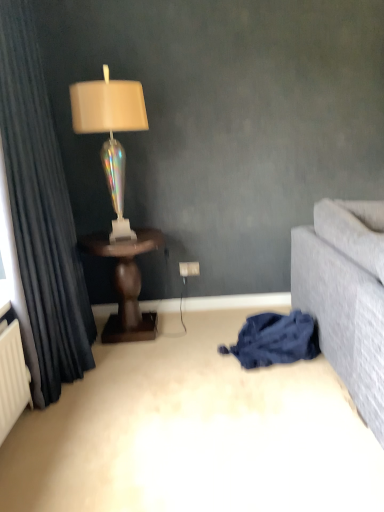
Question: Is blue cotton blanket at lower right not close to dark wood table at left?

Choices:
 (A) yes
 (B) no

Answer: (B)

Question: Is blue cotton blanket at lower right facing towards dark wood table at left?

Choices:
 (A) yes
 (B) no

Answer: (B)

Question: Is blue cotton blanket at lower right outside of dark wood table at left?

Choices:
 (A) no
 (B) yes

Answer: (B)

Question: Does blue cotton blanket at lower right have a smaller size compared to dark wood table at left?

Choices:
 (A) yes
 (B) no

Answer: (A)

Question: Is blue cotton blanket at lower right thinner than dark wood table at left?

Choices:
 (A) no
 (B) yes

Answer: (B)

Question: Is blue cotton blanket at lower right taller or shorter than dark wood table at left?

Choices:
 (A) short
 (B) tall

Answer: (A)

Question: Is blue cotton blanket at lower right wider or thinner than dark wood table at left?

Choices:
 (A) wide
 (B) thin

Answer: (B)

Question: From the image's perspective, is blue cotton blanket at lower right positioned above or below dark wood table at left?

Choices:
 (A) below
 (B) above

Answer: (A)

Question: From a real-world perspective, is blue cotton blanket at lower right above or below dark wood table at left?

Choices:
 (A) above
 (B) below

Answer: (B)

Question: Is blue cotton blanket at lower right situated inside iridescent glass lamp at left or outside?

Choices:
 (A) inside
 (B) outside

Answer: (B)

Question: From their relative heights in the image, would you say blue cotton blanket at lower right is taller or shorter than iridescent glass lamp at left?

Choices:
 (A) tall
 (B) short

Answer: (B)

Question: Considering their positions, is blue cotton blanket at lower right located in front of or behind iridescent glass lamp at left?

Choices:
 (A) front
 (B) behind

Answer: (A)

Question: Considering the positions of point (240, 349) and point (72, 125), is point (240, 349) closer or farther from the camera than point (72, 125)?

Choices:
 (A) farther
 (B) closer

Answer: (B)

Question: Is dark wood table at left in front of or behind blue cotton blanket at lower right in the image?

Choices:
 (A) front
 (B) behind

Answer: (B)

Question: From the image's perspective, is dark wood table at left located above or below blue cotton blanket at lower right?

Choices:
 (A) above
 (B) below

Answer: (A)